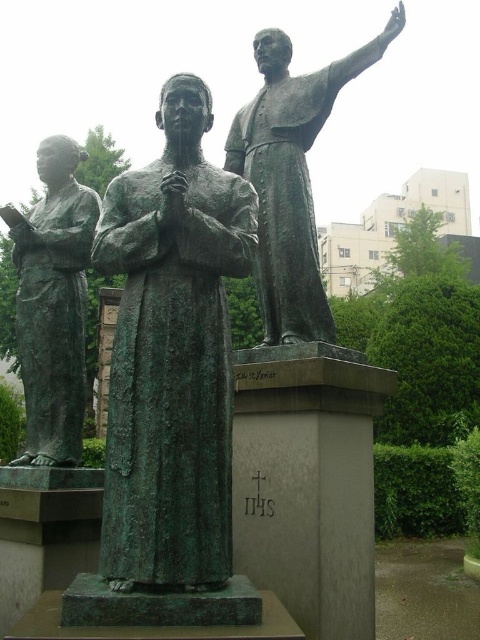
Who is positioned more to the right, bronze statue at upper right or green patina statue at left?

bronze statue at upper right

Does bronze statue at upper right have a lesser width compared to green patina statue at left?

Indeed, bronze statue at upper right has a lesser width compared to green patina statue at left.

Does point (330, 333) come closer to viewer compared to point (22, 380)?

Yes, it is.

Locate an element on the screen. The image size is (480, 640). bronze statue at upper right is located at coordinates (290, 177).

Is green patina bronze statue at center thinner than green patina statue at left?

Yes.

Between green patina bronze statue at center and green patina statue at left, which one is positioned higher?

green patina bronze statue at center

Measure the distance between point [182,544] and camera.

Point [182,544] is 22.19 feet from camera.

This screenshot has width=480, height=640. Identify the location of green patina bronze statue at center. (171, 355).

Between point (116, 332) and point (315, 131), which one is positioned in front?

Positioned in front is point (116, 332).

The image size is (480, 640). What are the coordinates of `green patina bronze statue at center` in the screenshot? It's located at (171, 355).

Where is `green patina bronze statue at center`? The height and width of the screenshot is (640, 480). green patina bronze statue at center is located at coordinates (171, 355).